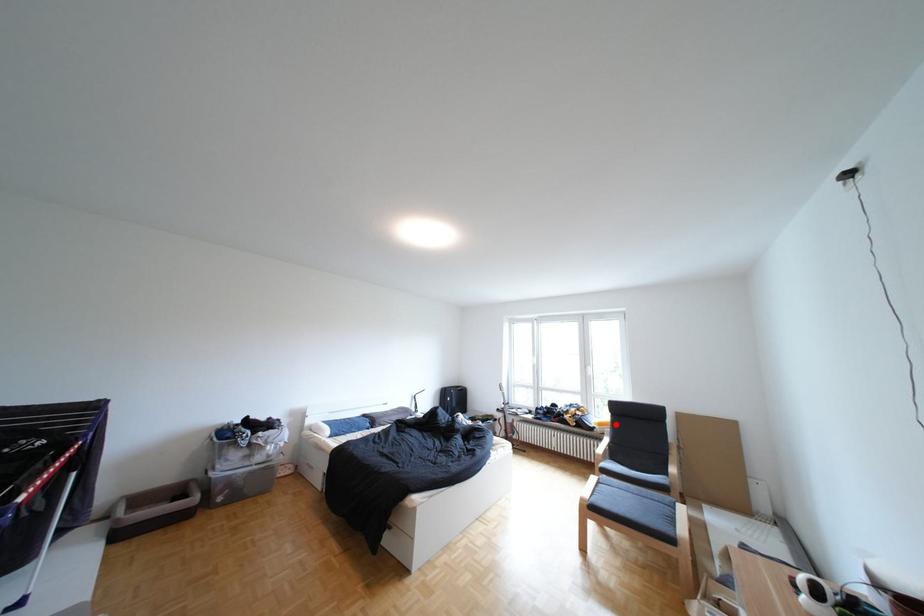
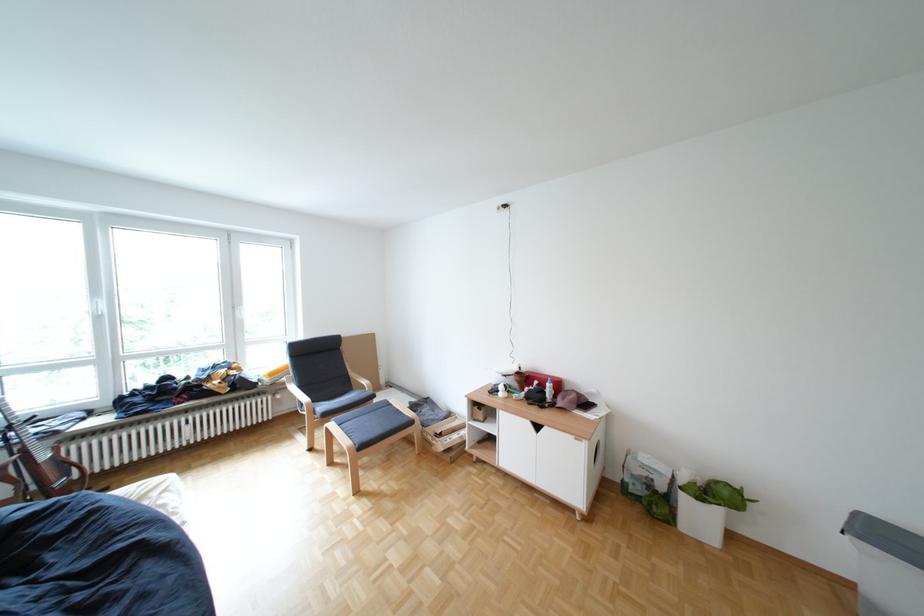
The point at the highlighted location is marked in the first image. Where is the corresponding point in the second image?

(286, 374)